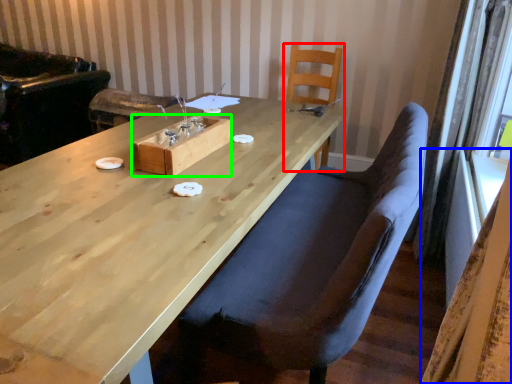
Question: Estimate the real-world distances between objects in this image. Which object is farther from chair (highlighted by a red box), curtain (highlighted by a blue box) or wood (highlighted by a green box)?

Choices:
 (A) curtain
 (B) wood

Answer: (A)